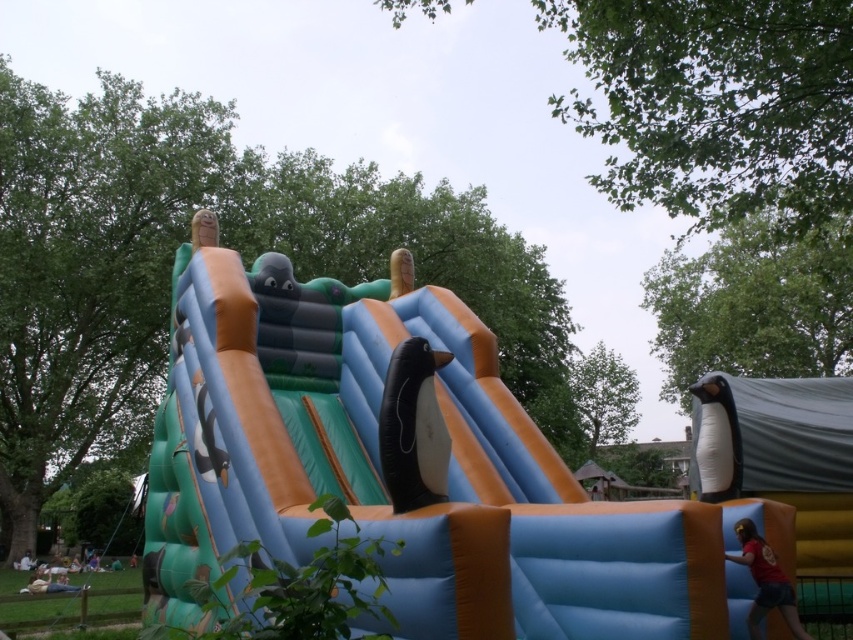
Does black rubber penguin at center have a greater height compared to white matte penguin at right?

In fact, black rubber penguin at center may be shorter than white matte penguin at right.

I want to click on black rubber penguin at center, so click(x=413, y=428).

Find the location of `black rubber penguin at center`. black rubber penguin at center is located at coordinates (413, 428).

Locate an element on the screen. This screenshot has width=853, height=640. black rubber penguin at center is located at coordinates (413, 428).

Which of these two, white matte penguin at right or red t-shirt at lower right, stands shorter?

Standing shorter between the two is red t-shirt at lower right.

Is point (701, 429) behind point (796, 611)?

Yes.

The width and height of the screenshot is (853, 640). I want to click on white matte penguin at right, so click(717, 440).

Is black rubber penguin at center to the left of red t-shirt at lower right from the viewer's perspective?

Yes, black rubber penguin at center is to the left of red t-shirt at lower right.

How much distance is there between black rubber penguin at center and red t-shirt at lower right?

The distance of black rubber penguin at center from red t-shirt at lower right is 2.65 meters.

Between point (413, 364) and point (755, 618), which one is positioned behind?

Positioned behind is point (755, 618).

Locate an element on the screen. The height and width of the screenshot is (640, 853). black rubber penguin at center is located at coordinates (413, 428).